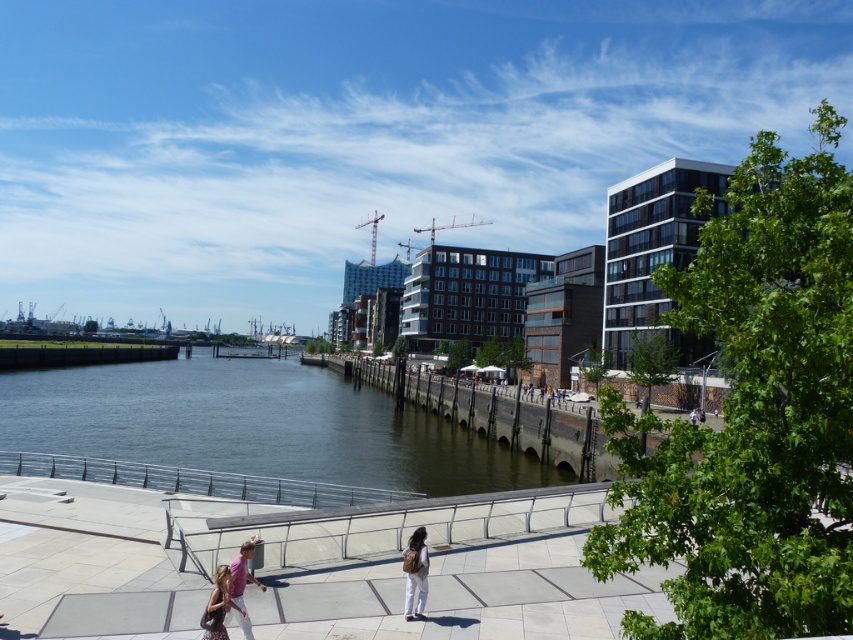
You are planning to cross the dark gray concrete river at center using the light brown backpack at center as a makeshift raft. Considering their sizes, do you think the backpack will be large enough to support your weight?

The dark gray concrete river at center is larger than the light brown backpack at center, so the backpack may not be large enough to safely support your weight as a makeshift raft.

You are a photographer standing on the waterfront walkway. You notice a matte pink backpack at lower left and a pink fabric at lower center. Which object is smaller in size?

The matte pink backpack at lower left is smaller in size compared to the pink fabric at lower center.

You are a delivery drone trying to navigate to the light brown backpack at center. Your GPS shows the backpack is at coordinates 0.895, 0.488. If the walkway runs along the edge from left to right, which direction should you fly to reach the backpack?

The light brown backpack at center is located at coordinates (415,572), so you should fly towards the center of the walkway to reach it.